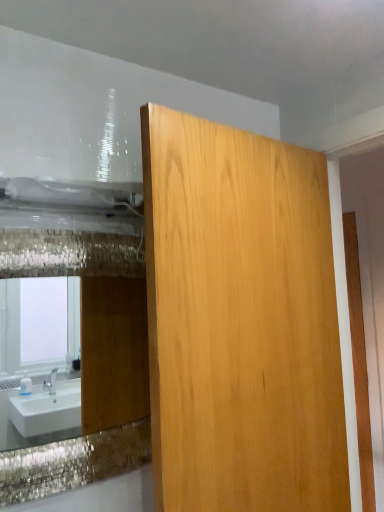
Question: Is point (114, 309) closer or farther from the camera than point (304, 238)?

Choices:
 (A) farther
 (B) closer

Answer: (A)

Question: From a real-world perspective, is shiny glass mirror at upper left positioned above or below light wood panel at center?

Choices:
 (A) below
 (B) above

Answer: (A)

Question: In the image, is shiny glass mirror at upper left positioned in front of or behind light wood panel at center?

Choices:
 (A) front
 (B) behind

Answer: (B)

Question: In the image, is light wood panel at center positioned in front of or behind shiny glass mirror at upper left?

Choices:
 (A) behind
 (B) front

Answer: (B)

Question: From the image's perspective, relative to shiny glass mirror at upper left, is light wood panel at center above or below?

Choices:
 (A) below
 (B) above

Answer: (B)

Question: In the image, is light wood panel at center on the left side or the right side of shiny glass mirror at upper left?

Choices:
 (A) right
 (B) left

Answer: (A)

Question: From a real-world perspective, relative to shiny glass mirror at upper left, is light wood panel at center vertically above or below?

Choices:
 (A) below
 (B) above

Answer: (B)